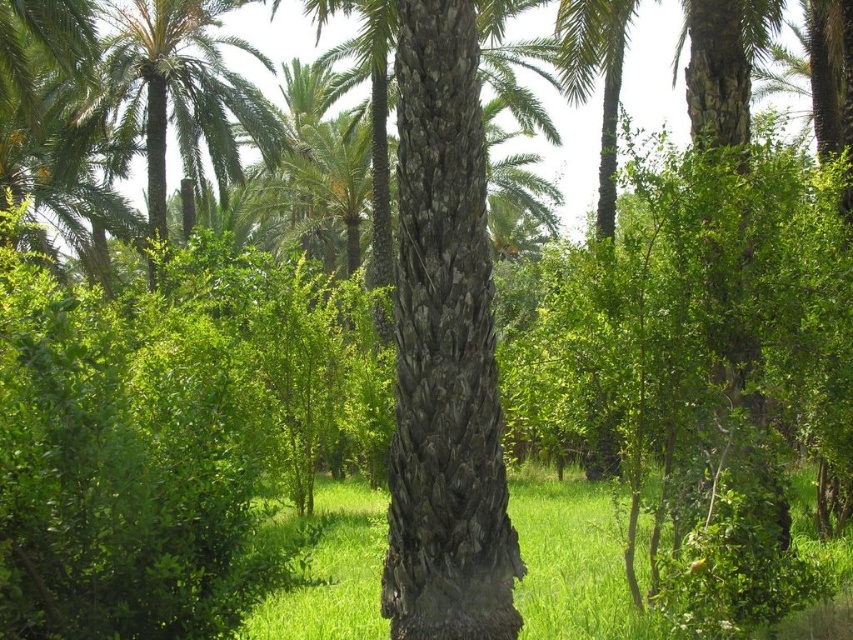
Image resolution: width=853 pixels, height=640 pixels. I want to click on green grass at center, so click(x=570, y=561).

Locate an element on the screen. The width and height of the screenshot is (853, 640). green grass at center is located at coordinates (570, 561).